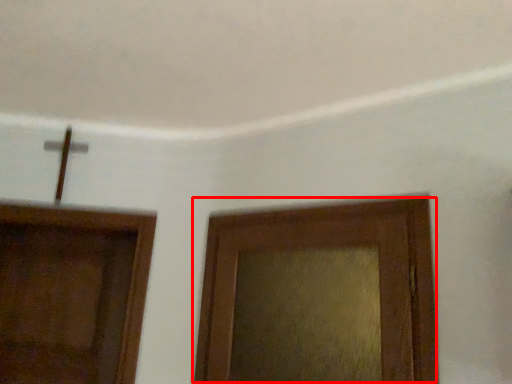
Question: From the image's perspective, what is the correct spatial positioning of door (annotated by the red box) in reference to door?

Choices:
 (A) below
 (B) above

Answer: (B)